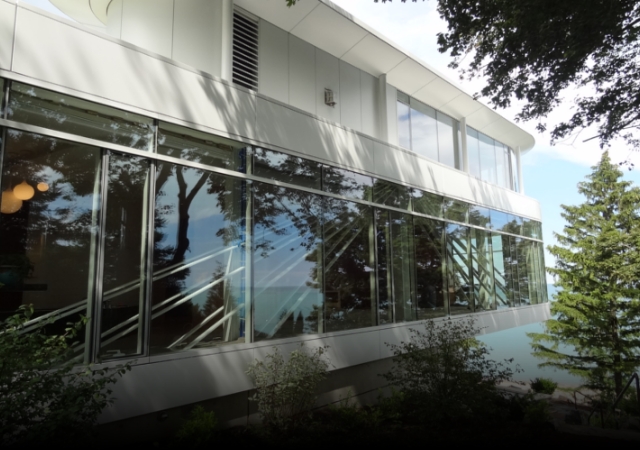
The height and width of the screenshot is (450, 640). In order to click on vent in this screenshot , I will do `click(246, 63)`.